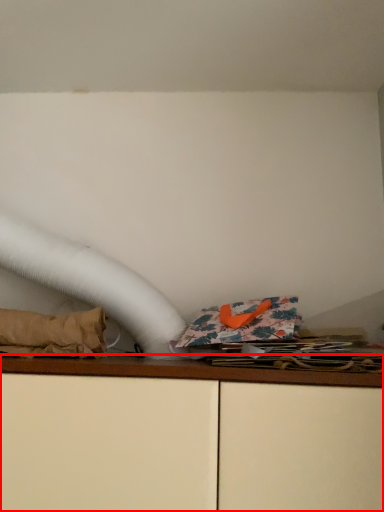
Question: From the image's perspective, considering the relative positions of furniture (annotated by the red box) and material in the image provided, where is furniture (annotated by the red box) located with respect to the staircase?

Choices:
 (A) below
 (B) above

Answer: (A)